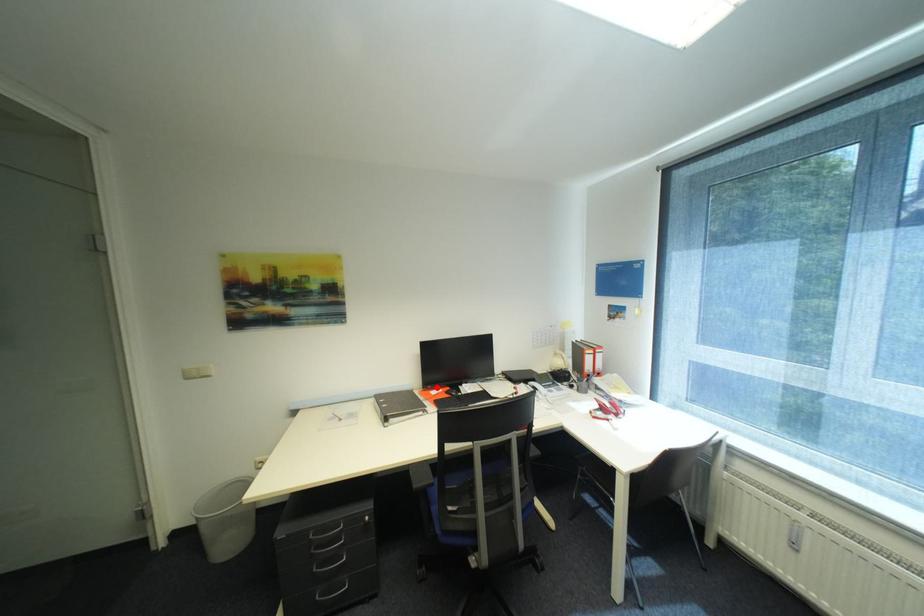
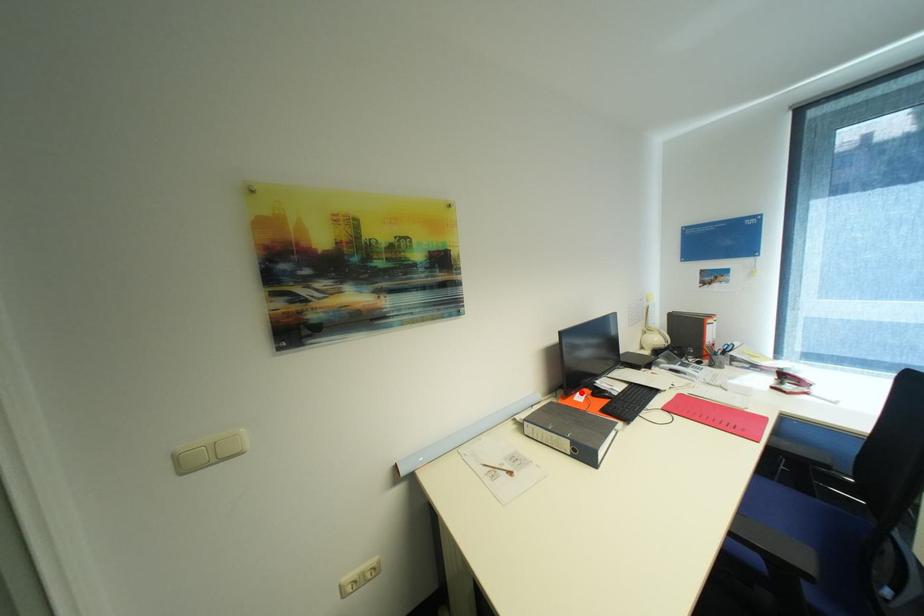
Based on the photo, I am providing you with two images of the same scene from different viewpoints. A red point is marked on the first image and another point is marked on the second image. Are the points marked in image1 and image2 representing the same 3D position?

Yes